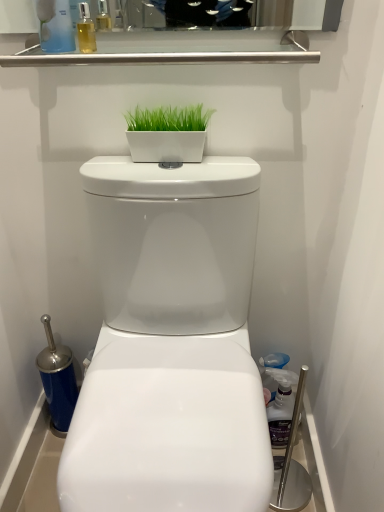
Question: Can you confirm if translucent plastic bottle at upper left, placed as the 2th cleaning product when sorted from right to left, is positioned to the right of green matte planter at center?

Choices:
 (A) yes
 (B) no

Answer: (B)

Question: Could you tell me if translucent plastic bottle at upper left, the 1th cleaning product positioned from the left, is turned towards green matte planter at center?

Choices:
 (A) no
 (B) yes

Answer: (A)

Question: Does translucent plastic bottle at upper left, which is the 1th cleaning product in front-to-back order, have a lesser width compared to green matte planter at center?

Choices:
 (A) no
 (B) yes

Answer: (A)

Question: Is green matte planter at center surrounded by translucent plastic bottle at upper left, which is the 1th cleaning product in front-to-back order?

Choices:
 (A) no
 (B) yes

Answer: (A)

Question: Is translucent plastic bottle at upper left, the second cleaning product ordered from the bottom, smaller than green matte planter at center?

Choices:
 (A) no
 (B) yes

Answer: (A)

Question: Is translucent plastic spray bottle at right, the first cleaning product when ordered from back to front, in front of or behind green matte planter at center in the image?

Choices:
 (A) behind
 (B) front

Answer: (A)

Question: From a real-world perspective, relative to green matte planter at center, is translucent plastic spray bottle at right, acting as the 2th cleaning product starting from the top, vertically above or below?

Choices:
 (A) above
 (B) below

Answer: (B)

Question: Is translucent plastic spray bottle at right, acting as the 2th cleaning product starting from the top, situated inside green matte planter at center or outside?

Choices:
 (A) inside
 (B) outside

Answer: (B)

Question: Would you say translucent plastic spray bottle at right, marked as the 2th cleaning product in a left-to-right arrangement, is to the left or to the right of green matte planter at center in the picture?

Choices:
 (A) left
 (B) right

Answer: (B)

Question: Is green matte planter at center to the left or to the right of translucent plastic bottle at upper left, which appears as the first cleaning product when viewed from the top, in the image?

Choices:
 (A) left
 (B) right

Answer: (B)

Question: Is green matte planter at center wider or thinner than translucent plastic bottle at upper left, the 1th cleaning product positioned from the left?

Choices:
 (A) wide
 (B) thin

Answer: (B)

Question: In terms of height, does green matte planter at center look taller or shorter compared to translucent plastic bottle at upper left, which is the 1th cleaning product in front-to-back order?

Choices:
 (A) tall
 (B) short

Answer: (B)

Question: Considering the positions of point (205, 132) and point (43, 9), is point (205, 132) closer or farther from the camera than point (43, 9)?

Choices:
 (A) farther
 (B) closer

Answer: (A)

Question: Would you say white glossy toilet at center is to the left or to the right of translucent plastic spray bottle at right, which ranks as the first cleaning product in right-to-left order, in the picture?

Choices:
 (A) left
 (B) right

Answer: (A)

Question: From a real-world perspective, is white glossy toilet at center positioned above or below translucent plastic spray bottle at right, the first cleaning product when ordered from back to front?

Choices:
 (A) above
 (B) below

Answer: (A)